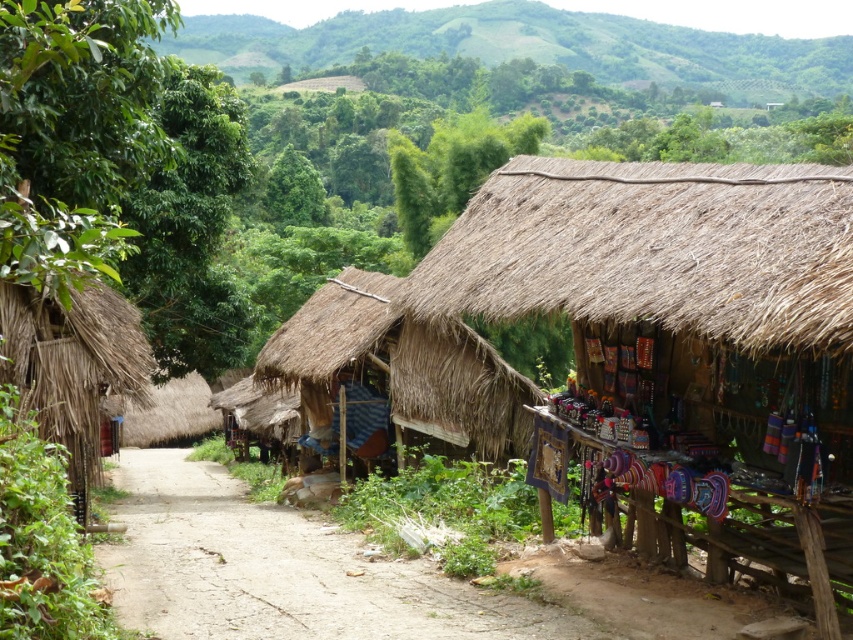
Where is `dirt path at center`? The image size is (853, 640). dirt path at center is located at coordinates (282, 570).

Is the position of dirt path at center less distant than that of green grassy hillside at upper center?

That is True.

I want to click on dirt path at center, so click(x=282, y=570).

This screenshot has width=853, height=640. In order to click on dirt path at center in this screenshot , I will do `click(282, 570)`.

Does thatched brown hut at center have a lesser width compared to thatched straw hut at left?

No, thatched brown hut at center is not thinner than thatched straw hut at left.

Does thatched brown hut at center have a greater height compared to thatched straw hut at left?

Indeed, thatched brown hut at center has a greater height compared to thatched straw hut at left.

Find the location of a particular element. thatched brown hut at center is located at coordinates (401, 365).

Does green grassy hillside at upper center appear on the right side of thatched straw hut at left?

Correct, you'll find green grassy hillside at upper center to the right of thatched straw hut at left.

Can you confirm if green grassy hillside at upper center is shorter than thatched straw hut at left?

No.

Does point (448, 22) come closer to viewer compared to point (74, 369)?

No.

The image size is (853, 640). Find the location of `green grassy hillside at upper center`. green grassy hillside at upper center is located at coordinates (531, 45).